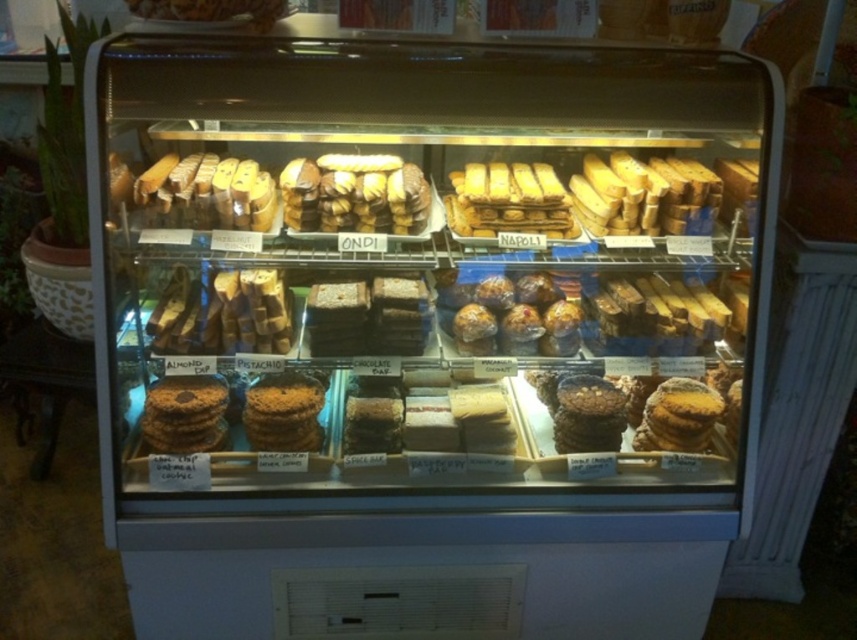
Who is positioned more to the left, brown matte cookies at center or chocolate cookie at center?

Positioned to the left is brown matte cookies at center.

Between brown matte cookies at center and chocolate cookie at center, which one is positioned higher?

Positioned higher is brown matte cookies at center.

Describe the element at coordinates (354, 195) in the screenshot. I see `brown matte cookies at center` at that location.

The image size is (857, 640). I want to click on brown matte cookies at center, so point(354,195).

Which of these two, brown crumbly cookie at lower left or chocolate cookie at center, stands shorter?

With less height is brown crumbly cookie at lower left.

Who is higher up, brown crumbly cookie at lower left or chocolate cookie at center?

Result: Positioned higher is brown crumbly cookie at lower left.

Between point (168, 426) and point (661, 410), which one is positioned in front?

Point (168, 426) is more forward.

Where is `brown crumbly cookie at lower left`? This screenshot has width=857, height=640. brown crumbly cookie at lower left is located at coordinates (184, 413).

Describe the element at coordinates (354, 195) in the screenshot. I see `brown matte cookies at center` at that location.

Between brown matte cookies at center and brown crumbly cookie at lower left, which one has more height?

brown matte cookies at center

Is point (337, 192) positioned after point (181, 420)?

Yes.

You are a GUI agent. You are given a task and a screenshot of the screen. Output one action in this format:
    pyautogui.click(x=<x>, y=<y>)
    Task: Click on the brown matte cookies at center
    The image size is (857, 640).
    Given the screenshot: What is the action you would take?
    click(354, 195)